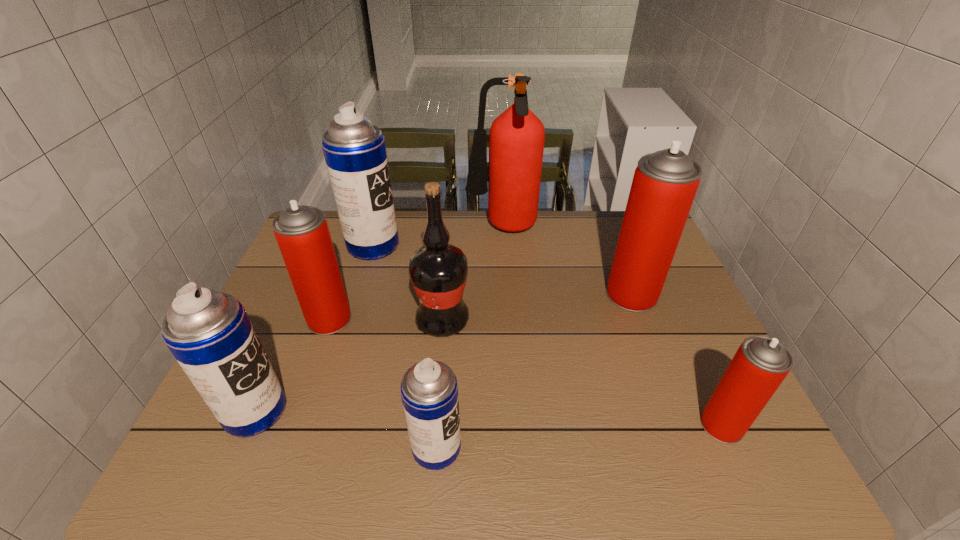
This screenshot has width=960, height=540. I want to click on vacant space that satisfies the following two spatial constraints: 1. at the nozzle of the fire extinguisher; 2. on the left side of the nearest red aerosol can, so click(514, 425).

This screenshot has width=960, height=540. I want to click on free spot that satisfies the following two spatial constraints: 1. on the label side of the nearest red aerosol can; 2. on the left side of the biggest blue aerosol can, so click(319, 425).

The width and height of the screenshot is (960, 540). In order to click on free location that satisfies the following two spatial constraints: 1. on the front side of the biggest red aerosol can; 2. on the label side of the second biggest blue aerosol can in this screenshot , I will do `click(676, 410)`.

This screenshot has height=540, width=960. What are the coordinates of `free spot that satisfies the following two spatial constraints: 1. on the label side of the biggest blue aerosol can; 2. on the right side of the biggest red aerosol can` in the screenshot? It's located at (358, 294).